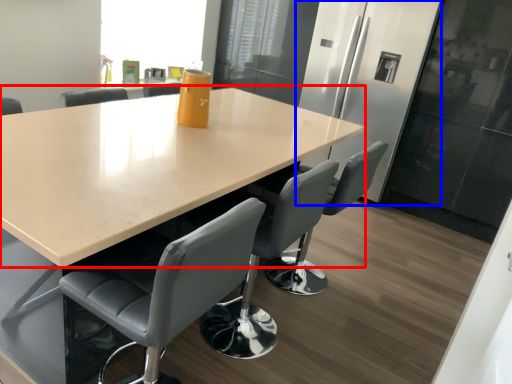
Question: Which object is further to the camera taking this photo, table (highlighted by a red box) or fridge (highlighted by a blue box)?

Choices:
 (A) table
 (B) fridge

Answer: (B)